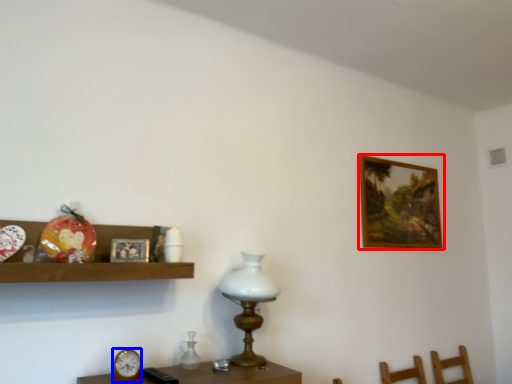
Question: Which point is closer to the camera, picture frame (highlighted by a red box) or clock (highlighted by a blue box)?

Choices:
 (A) picture frame
 (B) clock

Answer: (B)